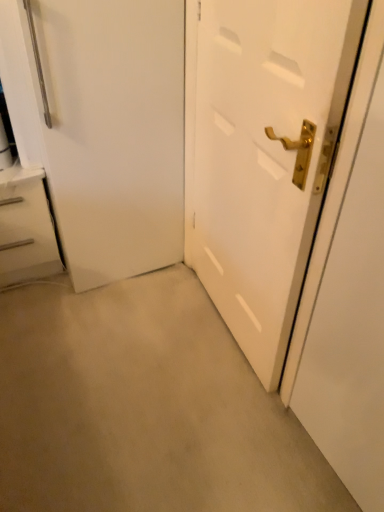
Question: From the image's perspective, is white glossy door handle at right beneath white glossy chest of drawers at left?

Choices:
 (A) no
 (B) yes

Answer: (B)

Question: Does white glossy door handle at right have a larger size compared to white glossy chest of drawers at left?

Choices:
 (A) no
 (B) yes

Answer: (A)

Question: Is white glossy door handle at right taller than white glossy chest of drawers at left?

Choices:
 (A) no
 (B) yes

Answer: (B)

Question: From a real-world perspective, is white glossy door handle at right positioned over white glossy chest of drawers at left based on gravity?

Choices:
 (A) yes
 (B) no

Answer: (A)

Question: Is white glossy chest of drawers at left surrounded by white glossy door handle at right?

Choices:
 (A) yes
 (B) no

Answer: (B)

Question: Is white glossy door handle at right positioned far away from white glossy chest of drawers at left?

Choices:
 (A) yes
 (B) no

Answer: (A)

Question: Is white matte door at center oriented away from white glossy chest of drawers at left?

Choices:
 (A) yes
 (B) no

Answer: (B)

Question: Is white matte door at center smaller than white glossy chest of drawers at left?

Choices:
 (A) no
 (B) yes

Answer: (B)

Question: Does white matte door at center appear on the right side of white glossy chest of drawers at left?

Choices:
 (A) yes
 (B) no

Answer: (A)

Question: Is white matte door at center taller than white glossy chest of drawers at left?

Choices:
 (A) no
 (B) yes

Answer: (B)

Question: Can you confirm if white matte door at center is bigger than white glossy chest of drawers at left?

Choices:
 (A) yes
 (B) no

Answer: (B)

Question: Does white matte door at center appear on the left side of white glossy chest of drawers at left?

Choices:
 (A) no
 (B) yes

Answer: (A)

Question: Does white glossy chest of drawers at left have a lesser height compared to white matte door at center?

Choices:
 (A) no
 (B) yes

Answer: (B)